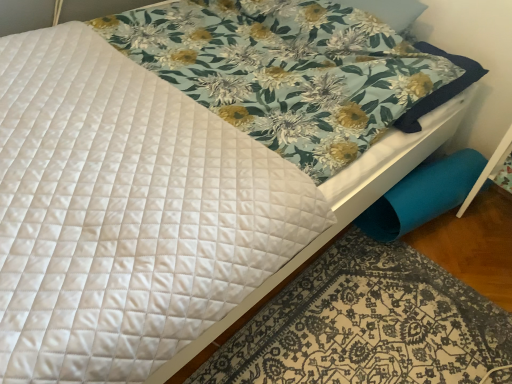
Find the location of a particular element. free space that is in between blue fabric at lower right and blue fabric swivel chair at lower right is located at coordinates (438, 264).